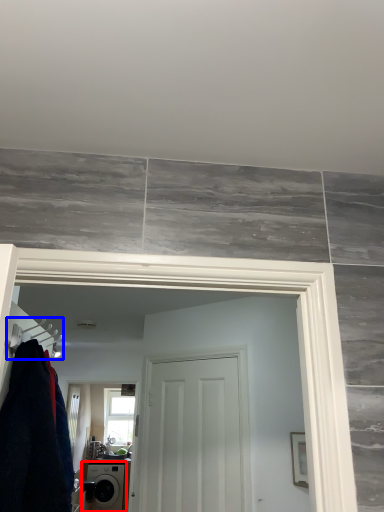
Question: Which of the following is the farthest to the observer, washing machine (highlighted by a red box) or hanger (highlighted by a blue box)?

Choices:
 (A) washing machine
 (B) hanger

Answer: (A)